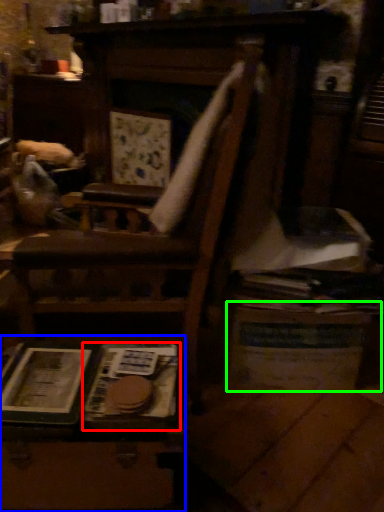
Question: Considering the real-world distances, which object is farthest from paperback book (highlighted by a red box)? table (highlighted by a blue box) or table (highlighted by a green box)?

Choices:
 (A) table
 (B) table

Answer: (B)